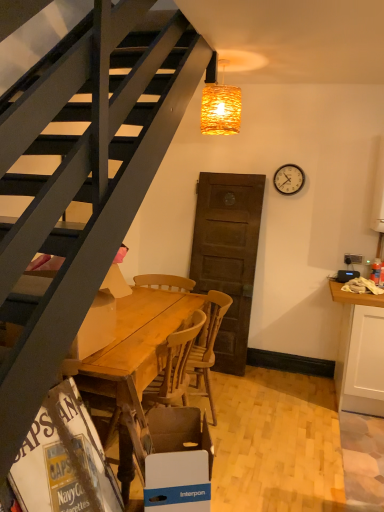
Locate an element on the screen. The height and width of the screenshot is (512, 384). vacant area on top of woven wicker lampshade at upper center (from a real-world perspective) is located at coordinates (233, 60).